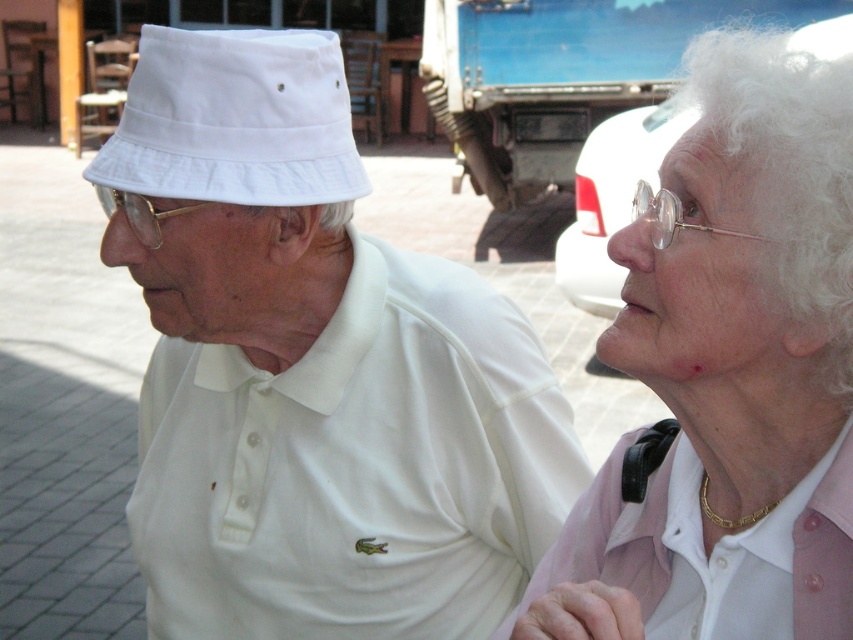
Question: Can you confirm if pink satin blouse at upper right is positioned below white cotton bucket hat at left?

Choices:
 (A) no
 (B) yes

Answer: (B)

Question: Based on their relative distances, which object is farther from the white matte hat at left?

Choices:
 (A) pink satin blouse at upper right
 (B) white cotton bucket hat at left

Answer: (A)

Question: Can you confirm if white matte hat at left is positioned to the right of white cotton bucket hat at left?

Choices:
 (A) yes
 (B) no

Answer: (A)

Question: Where is white matte hat at left located in relation to white cotton bucket hat at left in the image?

Choices:
 (A) right
 (B) left

Answer: (A)

Question: Which point is closer to the camera taking this photo?

Choices:
 (A) (231, 74)
 (B) (828, 548)
 (C) (570, 458)

Answer: (B)

Question: Considering the real-world distances, which object is farthest from the pink satin blouse at upper right?

Choices:
 (A) white matte hat at left
 (B) white cotton bucket hat at left

Answer: (B)